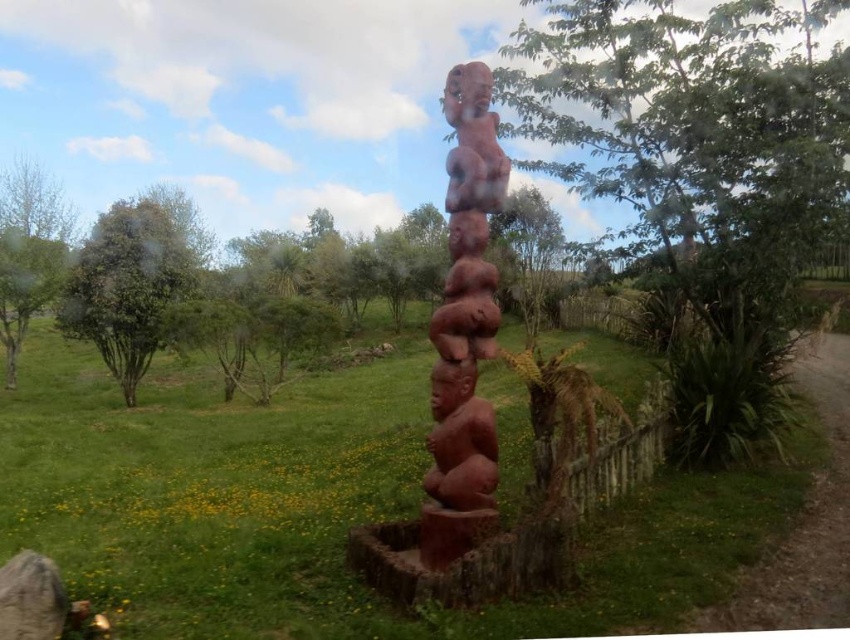
From the picture: You are planning to take a photo of the wooden sculpture. To ensure both the green leafy tree at center and the green leafy tree at left are in the frame, which tree should you position closer to the camera to avoid cropping?

You should position the green leafy tree at center closer to the camera because it is wider than the green leafy tree at left, so it will take up more space in the frame and needs to be centered properly.